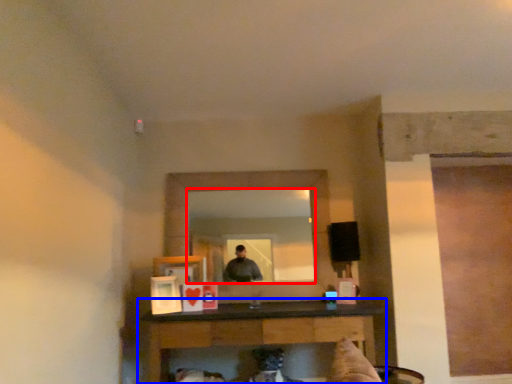
Question: Which object appears closest to the camera in this image, mirror (highlighted by a red box) or table (highlighted by a blue box)?

Choices:
 (A) mirror
 (B) table

Answer: (B)